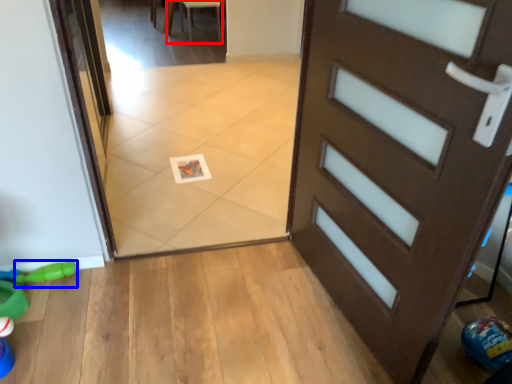
Question: Which point is closer to the camera, chair (highlighted by a red box) or toy (highlighted by a blue box)?

Choices:
 (A) chair
 (B) toy

Answer: (B)